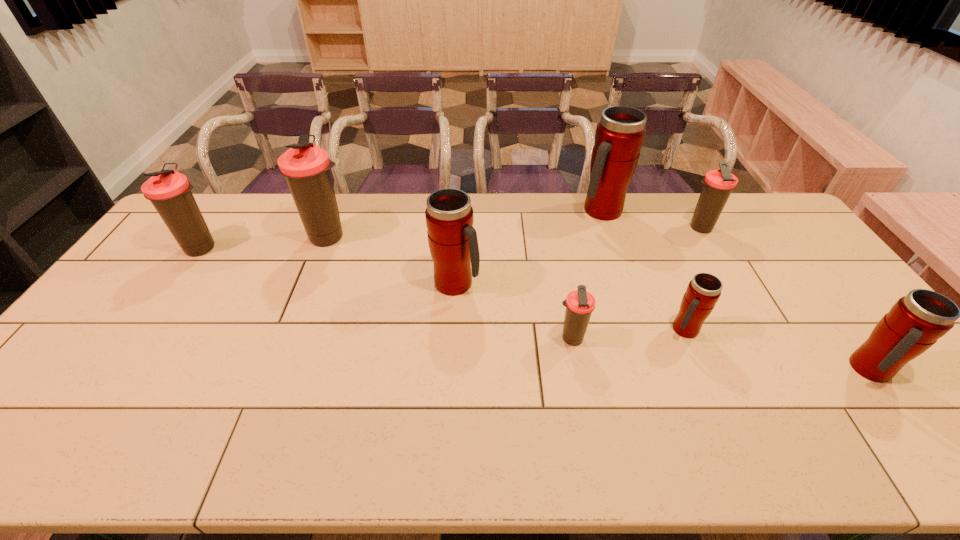
In order to click on the farthest red thermos bottle in this screenshot , I will do `click(620, 133)`.

In order to click on the biggest brown thermos bottle in this screenshot , I will do `click(306, 167)`.

Identify the location of the seventh object from right to left. Image resolution: width=960 pixels, height=540 pixels. (306, 167).

Locate an element on the screen. The height and width of the screenshot is (540, 960). the leftmost thermos bottle is located at coordinates (169, 191).

The width and height of the screenshot is (960, 540). I want to click on the leftmost object, so click(x=169, y=191).

Locate an element on the screen. The image size is (960, 540). the third smallest red thermos bottle is located at coordinates (452, 239).

This screenshot has width=960, height=540. I want to click on the fourth nearest thermos bottle, so click(452, 239).

Where is `the second thermos bottle from right to left`? This screenshot has height=540, width=960. the second thermos bottle from right to left is located at coordinates (718, 184).

Locate an element on the screen. This screenshot has height=540, width=960. the rightmost brown thermos bottle is located at coordinates (718, 184).

Identify the location of the rightmost object. (916, 321).